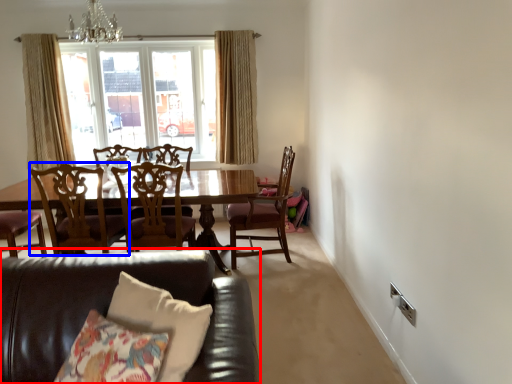
Question: Among these objects, which one is farthest to the camera, studio couch (highlighted by a red box) or chair (highlighted by a blue box)?

Choices:
 (A) studio couch
 (B) chair

Answer: (B)